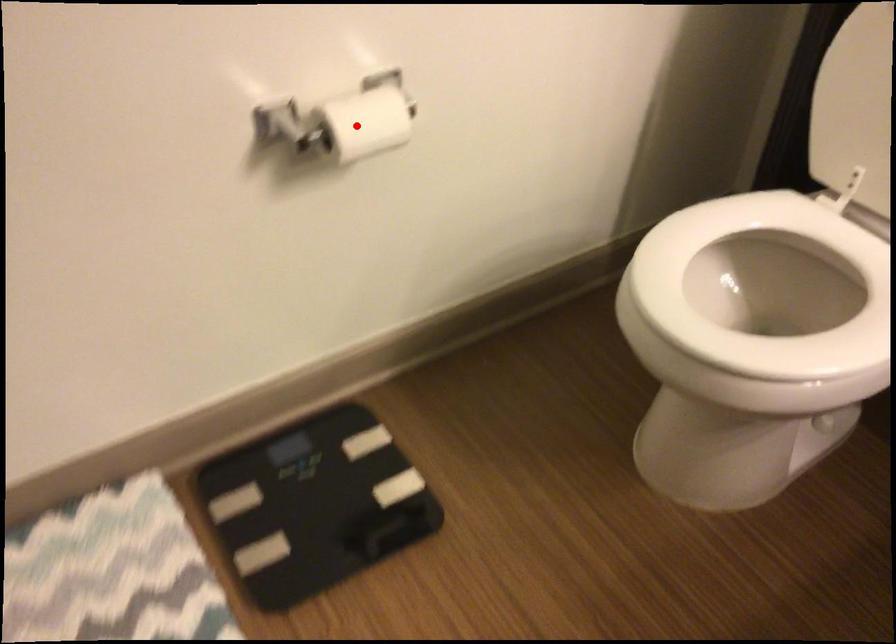
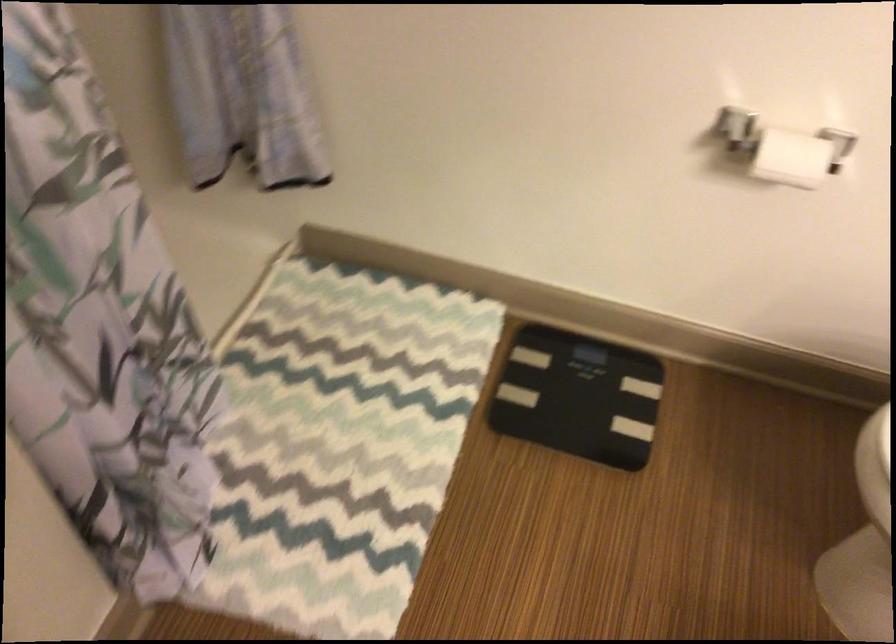
Locate, in the second image, the point that corresponds to the highlighted location in the first image.

(798, 156)